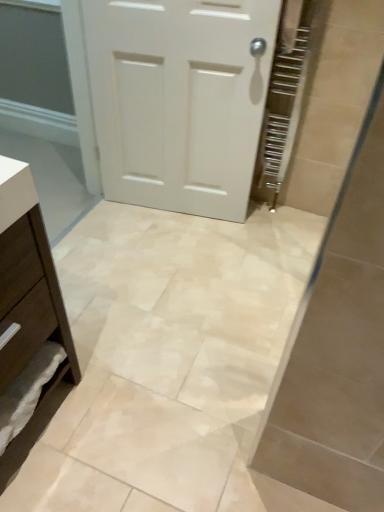
Question: Considering the relative sizes of white matte door at center and brown matte chest of drawers at lower left in the image provided, is white matte door at center wider than brown matte chest of drawers at lower left?

Choices:
 (A) no
 (B) yes

Answer: (A)

Question: Is white matte door at center facing away from brown matte chest of drawers at lower left?

Choices:
 (A) yes
 (B) no

Answer: (B)

Question: Is white matte door at center positioned before brown matte chest of drawers at lower left?

Choices:
 (A) no
 (B) yes

Answer: (A)

Question: Considering the relative sizes of white matte door at center and brown matte chest of drawers at lower left in the image provided, is white matte door at center taller than brown matte chest of drawers at lower left?

Choices:
 (A) no
 (B) yes

Answer: (B)

Question: Does white matte door at center have a lesser width compared to brown matte chest of drawers at lower left?

Choices:
 (A) no
 (B) yes

Answer: (B)

Question: Is white matte door at center far away from brown matte chest of drawers at lower left?

Choices:
 (A) no
 (B) yes

Answer: (B)

Question: Considering the relative sizes of brown matte chest of drawers at lower left and white matte door at center in the image provided, is brown matte chest of drawers at lower left shorter than white matte door at center?

Choices:
 (A) yes
 (B) no

Answer: (A)

Question: Is brown matte chest of drawers at lower left located outside white matte door at center?

Choices:
 (A) no
 (B) yes

Answer: (B)

Question: Is brown matte chest of drawers at lower left positioned in front of white matte door at center?

Choices:
 (A) no
 (B) yes

Answer: (B)

Question: Considering the relative sizes of brown matte chest of drawers at lower left and white matte door at center in the image provided, is brown matte chest of drawers at lower left bigger than white matte door at center?

Choices:
 (A) yes
 (B) no

Answer: (A)

Question: Is the depth of brown matte chest of drawers at lower left greater than that of white matte door at center?

Choices:
 (A) yes
 (B) no

Answer: (B)

Question: Is brown matte chest of drawers at lower left far from white matte door at center?

Choices:
 (A) no
 (B) yes

Answer: (B)

Question: Which is correct: white matte door at center is inside brown matte chest of drawers at lower left, or outside of it?

Choices:
 (A) inside
 (B) outside

Answer: (B)